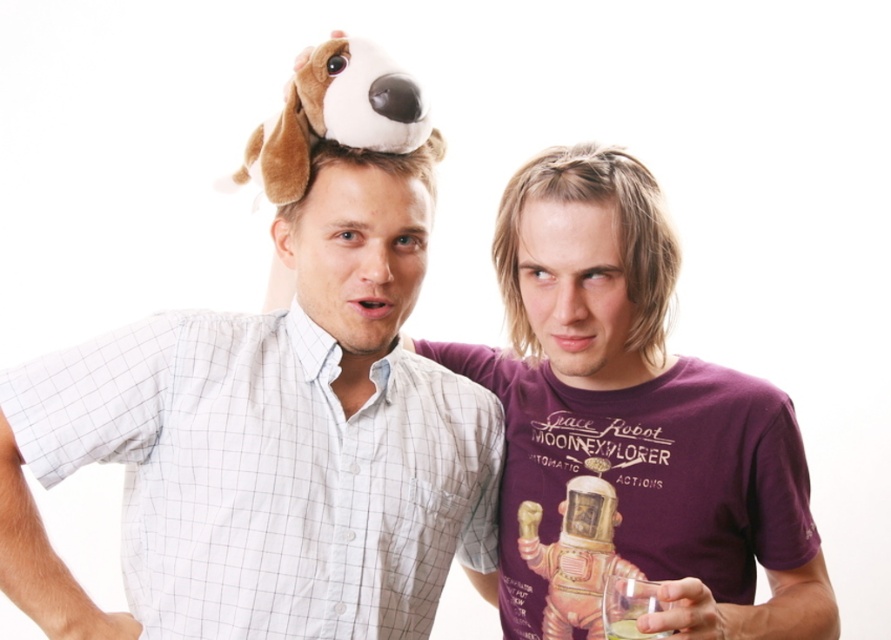
Question: Which point is farther to the camera?

Choices:
 (A) brown plush dog at center
 (B) purple cotton t-shirt at right

Answer: (A)

Question: Considering the real-world distances, which object is closest to the brown plush dog at center?

Choices:
 (A) matte purple shirt at center
 (B) purple cotton t-shirt at right
 (C) plush toy dog at center

Answer: (C)

Question: Which of the following is the farthest from the observer?

Choices:
 (A) (435, 140)
 (B) (292, 131)
 (C) (614, 625)

Answer: (A)

Question: Can you confirm if matte purple shirt at center is smaller than translucent glass at lower right?

Choices:
 (A) yes
 (B) no

Answer: (B)

Question: Does plush toy dog at center appear on the left side of matte purple shirt at center?

Choices:
 (A) no
 (B) yes

Answer: (B)

Question: Does brown plush dog at center appear on the right side of translucent glass at lower right?

Choices:
 (A) no
 (B) yes

Answer: (A)